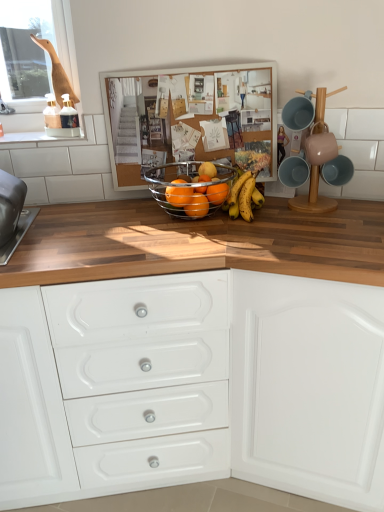
Locate an element on the screen. Image resolution: width=384 pixels, height=512 pixels. spots to the right of glossy orange at center, which is the fourth orange in left-to-right order is located at coordinates (257, 221).